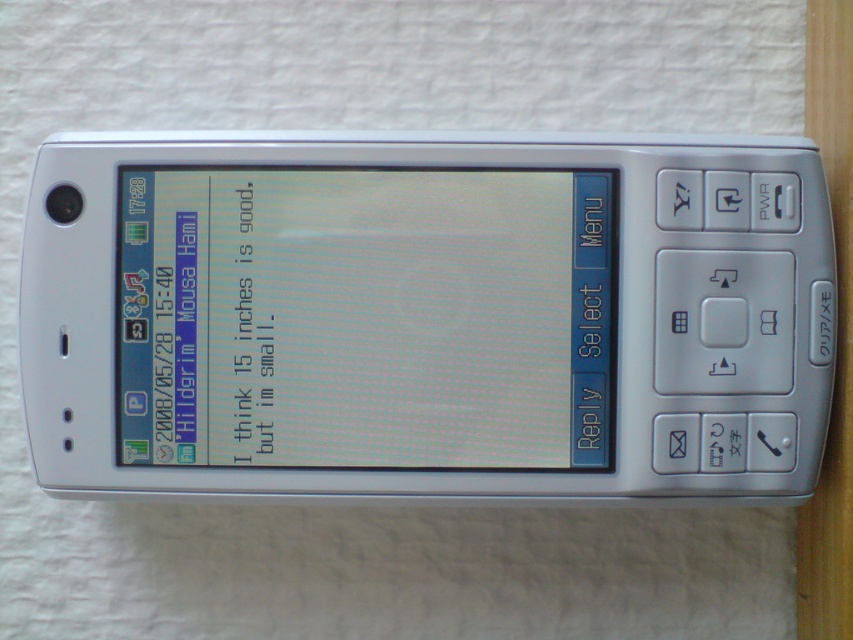
Question: Does silver metallic phone at center have a smaller size compared to matte plastic screen at center?

Choices:
 (A) no
 (B) yes

Answer: (A)

Question: Which point is closer to the camera?

Choices:
 (A) (166, 296)
 (B) (437, 348)

Answer: (B)

Question: Can you confirm if silver metallic phone at center is positioned to the left of matte plastic screen at center?

Choices:
 (A) no
 (B) yes

Answer: (A)

Question: Which of the following is the closest to the observer?

Choices:
 (A) silver metallic phone at center
 (B) matte plastic screen at center

Answer: (A)

Question: Does silver metallic phone at center come behind matte plastic screen at center?

Choices:
 (A) no
 (B) yes

Answer: (A)